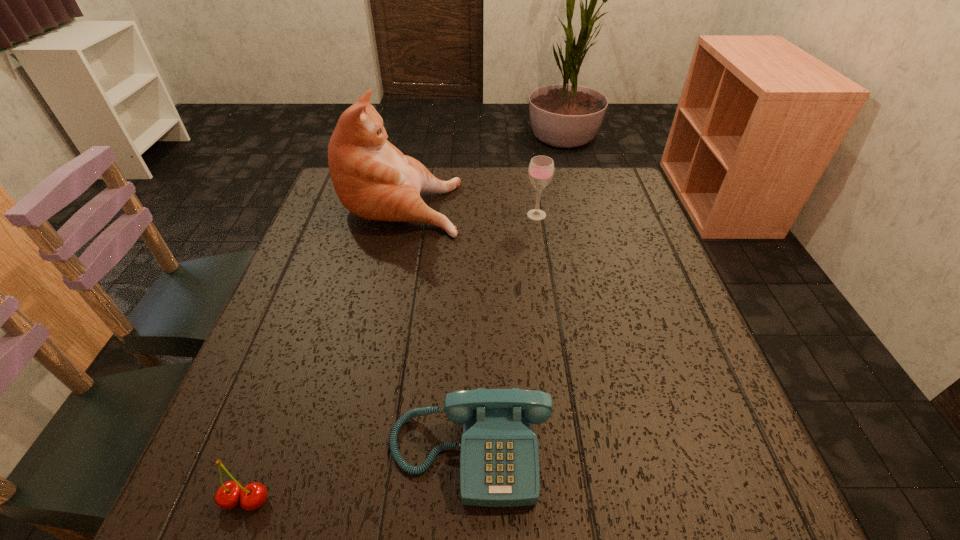
Find the location of a particular element. cat is located at coordinates (374, 180).

At what (x,y) coordinates should I click in order to perform the action: click on wineglass. Please return your answer as a coordinate pair (x, y). This screenshot has width=960, height=540. Looking at the image, I should click on (541, 168).

At what (x,y) coordinates should I click in order to perform the action: click on the third shortest object. Please return your answer as a coordinate pair (x, y). This screenshot has width=960, height=540. Looking at the image, I should click on (541, 168).

What are the coordinates of `telephone` in the screenshot? It's located at (499, 460).

Where is `cherry`? This screenshot has width=960, height=540. cherry is located at coordinates (230, 494).

Where is `blank area located 0.360m on the face of the cat`? blank area located 0.360m on the face of the cat is located at coordinates (588, 203).

You are a GUI agent. You are given a task and a screenshot of the screen. Output one action in this format:
    pyautogui.click(x=<x>, y=<y>)
    Task: Click on the free space located on the left of the second tallest object
    The height and width of the screenshot is (540, 960).
    Given the screenshot: What is the action you would take?
    pyautogui.click(x=425, y=215)

Where is `cat that is at the far edge`? The width and height of the screenshot is (960, 540). cat that is at the far edge is located at coordinates (374, 180).

Where is `wineglass situated at the far edge`? This screenshot has width=960, height=540. wineglass situated at the far edge is located at coordinates (541, 168).

You are a GUI agent. You are given a task and a screenshot of the screen. Output one action in this format:
    pyautogui.click(x=<x>, y=<y>)
    Task: Click on the telephone positioned at the near edge
    The width and height of the screenshot is (960, 540).
    Given the screenshot: What is the action you would take?
    coord(499,460)